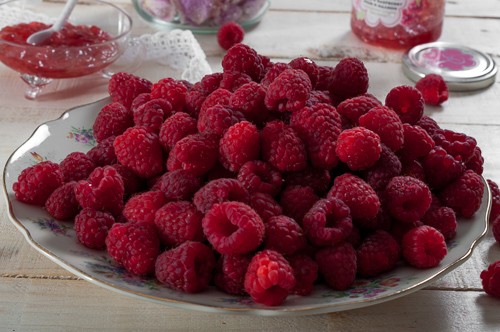
Locate an element on the screen. The height and width of the screenshot is (332, 500). bowl is located at coordinates (231, 296), (85, 49), (211, 10), (406, 19).